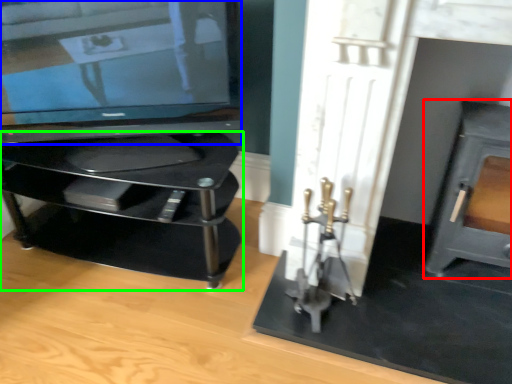
Question: Estimate the real-world distances between objects in this image. Which object is farther from fireplace (highlighted by a red box), television (highlighted by a blue box) or furniture (highlighted by a green box)?

Choices:
 (A) television
 (B) furniture

Answer: (A)